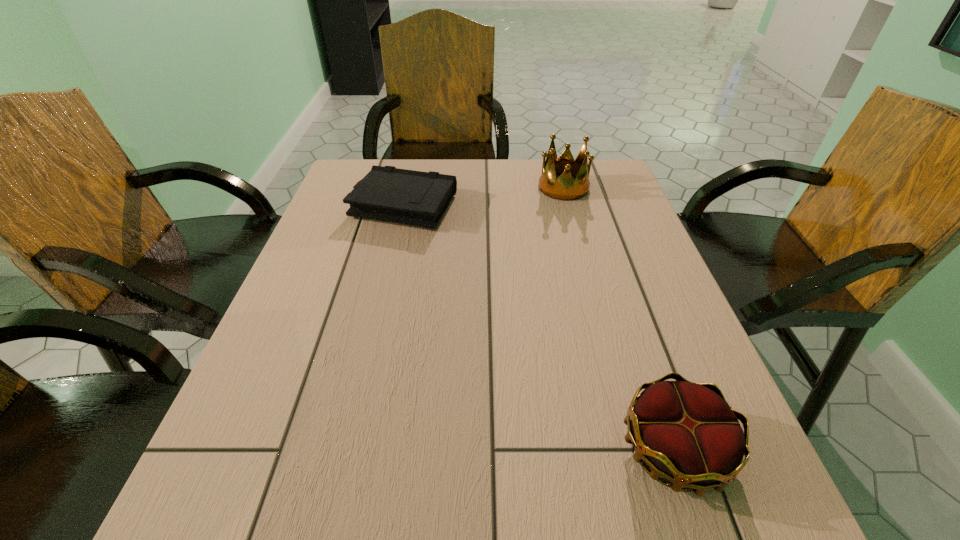
I want to click on the tallest object, so pos(564,188).

Locate an element on the screen. The image size is (960, 540). the farther crown is located at coordinates (564, 188).

Where is `the second tallest object`? The height and width of the screenshot is (540, 960). the second tallest object is located at coordinates (686, 432).

Image resolution: width=960 pixels, height=540 pixels. What are the coordinates of `the nearest object` in the screenshot? It's located at (686, 432).

This screenshot has height=540, width=960. What are the coordinates of `the shortest object` in the screenshot? It's located at (387, 193).

The height and width of the screenshot is (540, 960). I want to click on Bible, so click(387, 193).

The height and width of the screenshot is (540, 960). In order to click on free space located on the left of the farther crown in this screenshot , I will do `click(444, 187)`.

The width and height of the screenshot is (960, 540). I want to click on vacant space situated 0.400m on the left of the nearest object, so click(359, 449).

You are a GUI agent. You are given a task and a screenshot of the screen. Output one action in this format:
    pyautogui.click(x=<x>, y=<y>)
    Task: Click on the vacant space located on the front of the leftmost object
    
    Given the screenshot: What is the action you would take?
    pyautogui.click(x=394, y=245)

In order to click on crown at the far edge in this screenshot , I will do `click(564, 188)`.